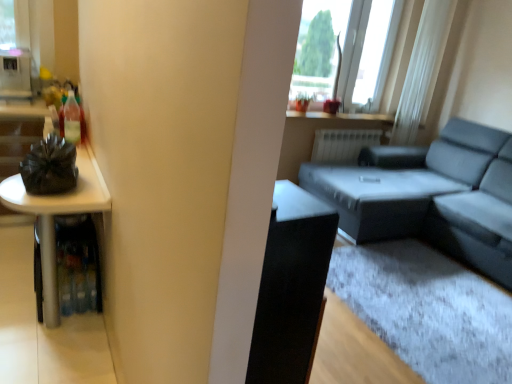
Question: From a real-world perspective, is white glossy refrigerator at upper left located higher than transparent glass window at upper right?

Choices:
 (A) no
 (B) yes

Answer: (A)

Question: Is there a large distance between white glossy refrigerator at upper left and transparent glass window at upper right?

Choices:
 (A) no
 (B) yes

Answer: (B)

Question: Is white glossy refrigerator at upper left in front of transparent glass window at upper right?

Choices:
 (A) yes
 (B) no

Answer: (A)

Question: Are white glossy refrigerator at upper left and transparent glass window at upper right beside each other?

Choices:
 (A) no
 (B) yes

Answer: (A)

Question: Is the position of white glossy refrigerator at upper left more distant than that of transparent glass window at upper right?

Choices:
 (A) no
 (B) yes

Answer: (A)

Question: From the image's perspective, is white glossy refrigerator at upper left on transparent glass window at upper right?

Choices:
 (A) yes
 (B) no

Answer: (B)

Question: Is transparent glass window at upper right aimed at matte gray couch at right?

Choices:
 (A) no
 (B) yes

Answer: (B)

Question: From the image's perspective, is transparent glass window at upper right over matte gray couch at right?

Choices:
 (A) no
 (B) yes

Answer: (B)

Question: Is transparent glass window at upper right completely or partially outside of matte gray couch at right?

Choices:
 (A) no
 (B) yes

Answer: (B)

Question: Can you confirm if transparent glass window at upper right is smaller than matte gray couch at right?

Choices:
 (A) yes
 (B) no

Answer: (A)

Question: From a real-world perspective, is transparent glass window at upper right physically above matte gray couch at right?

Choices:
 (A) no
 (B) yes

Answer: (B)

Question: Would you consider transparent glass window at upper right to be distant from matte gray couch at right?

Choices:
 (A) no
 (B) yes

Answer: (B)

Question: Does matte gray couch at right appear on the left side of white glossy refrigerator at upper left?

Choices:
 (A) yes
 (B) no

Answer: (B)